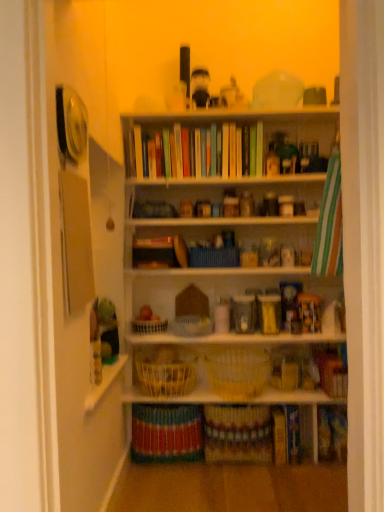
Question: In which direction should I rotate to look at white woven basket at center, which ranks as the 3th basket in bottom-to-top order?

Choices:
 (A) left
 (B) right

Answer: (A)

Question: Is white woven basket at center, the 2th basket when ordered from top to bottom, thinner than multicolored woven basket at lower center, acting as the third book starting from the right?

Choices:
 (A) no
 (B) yes

Answer: (B)

Question: Considering the relative sizes of white woven basket at center, the 2th basket when ordered from top to bottom, and multicolored woven basket at lower center, the first book when ordered from left to right, in the image provided, is white woven basket at center, the 2th basket when ordered from top to bottom, shorter than multicolored woven basket at lower center, the first book when ordered from left to right,?

Choices:
 (A) no
 (B) yes

Answer: (B)

Question: From a real-world perspective, is white woven basket at center, which is the fourth basket in bottom-to-top order, physically below multicolored woven basket at lower center, the first book when ordered from left to right?

Choices:
 (A) yes
 (B) no

Answer: (B)

Question: From the image's perspective, is white woven basket at center, the 2th basket when ordered from top to bottom, below multicolored woven basket at lower center, acting as the third book starting from the right?

Choices:
 (A) yes
 (B) no

Answer: (B)

Question: Is white woven basket at center, which is the fourth basket in bottom-to-top order, looking in the opposite direction of multicolored woven basket at lower center, acting as the third book starting from the right?

Choices:
 (A) no
 (B) yes

Answer: (A)

Question: Does white woven basket at center, the 2th basket when ordered from top to bottom, appear on the left side of multicolored woven basket at lower center, the first book when ordered from left to right?

Choices:
 (A) no
 (B) yes

Answer: (A)

Question: Does hardcover book at lower right, which is the 2th book in right-to-left order, have a lesser height compared to multicolored woven basket at lower center, acting as the third book starting from the right?

Choices:
 (A) yes
 (B) no

Answer: (A)

Question: Is hardcover book at lower right, which is the 2th book in right-to-left order, outside of multicolored woven basket at lower center, acting as the third book starting from the right?

Choices:
 (A) no
 (B) yes

Answer: (B)

Question: Is hardcover book at lower right, placed as the second book when sorted from left to right, oriented away from multicolored woven basket at lower center, acting as the third book starting from the right?

Choices:
 (A) no
 (B) yes

Answer: (A)

Question: Is hardcover book at lower right, which is the 2th book in right-to-left order, to the right of multicolored woven basket at lower center, acting as the third book starting from the right, from the viewer's perspective?

Choices:
 (A) no
 (B) yes

Answer: (B)

Question: Is hardcover book at lower right, which is the 2th book in right-to-left order, in front of multicolored woven basket at lower center, acting as the third book starting from the right?

Choices:
 (A) no
 (B) yes

Answer: (A)

Question: Does hardcover book at lower right, which is the 2th book in right-to-left order, appear on the left side of multicolored woven basket at lower center, acting as the third book starting from the right?

Choices:
 (A) yes
 (B) no

Answer: (B)

Question: Considering the relative sizes of multicolored woven basket at lower center, acting as the third book starting from the right, and matte brown book at lower right, placed as the 3th book when sorted from left to right, in the image provided, is multicolored woven basket at lower center, acting as the third book starting from the right, smaller than matte brown book at lower right, placed as the 3th book when sorted from left to right,?

Choices:
 (A) yes
 (B) no

Answer: (B)